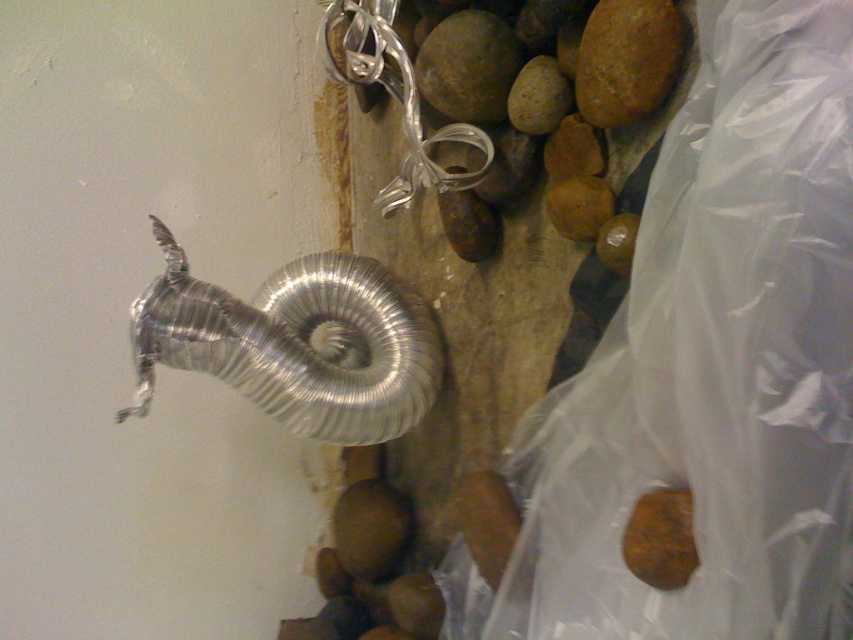
Question: Among these objects, which one is nearest to the camera?

Choices:
 (A) metallic silver chain at upper center
 (B) smooth brown rock at center

Answer: (B)

Question: Can you confirm if brown matte stone at lower right is positioned to the right of smooth brown rock at center?

Choices:
 (A) yes
 (B) no

Answer: (A)

Question: Does metallic silver chain at upper center have a larger size compared to brown matte stone at lower right?

Choices:
 (A) yes
 (B) no

Answer: (A)

Question: Which of the following is the closest to the observer?

Choices:
 (A) smooth brown rock at upper right
 (B) smooth brown rock at upper center

Answer: (A)

Question: Can you confirm if smooth brown rock at upper right is positioned below brown matte stone at lower right?

Choices:
 (A) yes
 (B) no

Answer: (B)

Question: Which of the following is the farthest from the observer?

Choices:
 (A) smooth brown rock at upper right
 (B) transparent plastic bag at right
 (C) metallic silver chain at upper center
 (D) brown matte stone at lower right

Answer: (C)